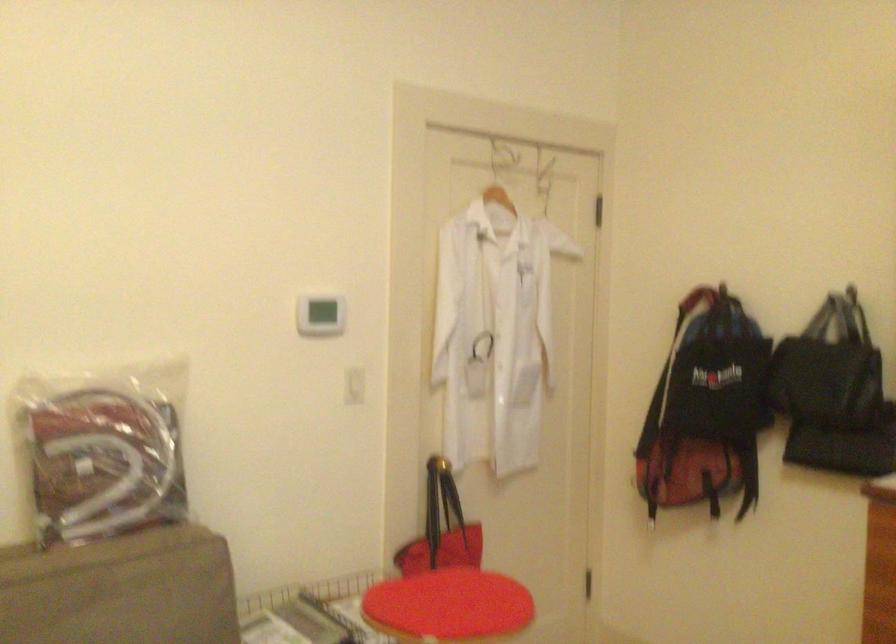
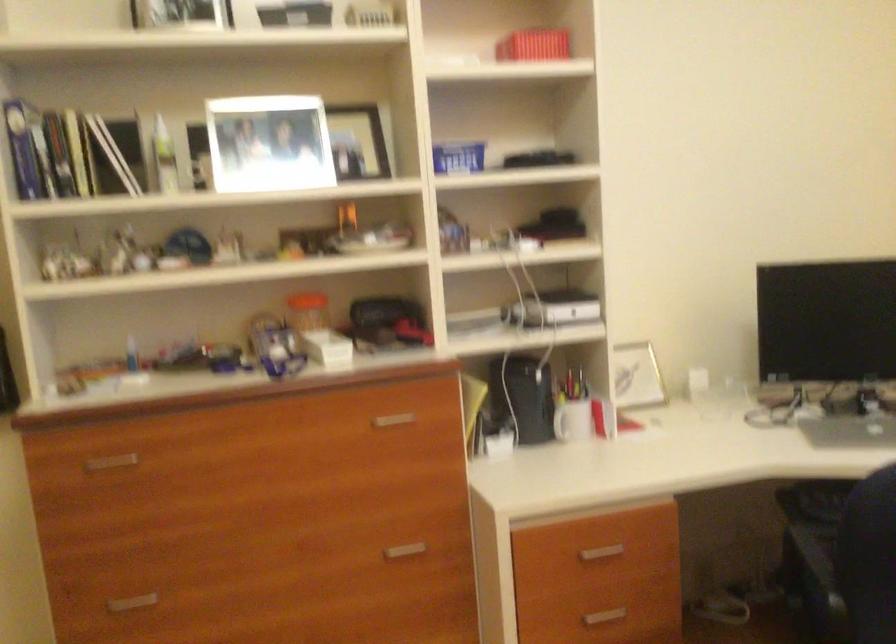
Question: The images are taken continuously from a first-person perspective. In which direction is your viewpoint rotating?

Choices:
 (A) Left
 (B) Right
 (C) Up
 (D) Down

Answer: (B)